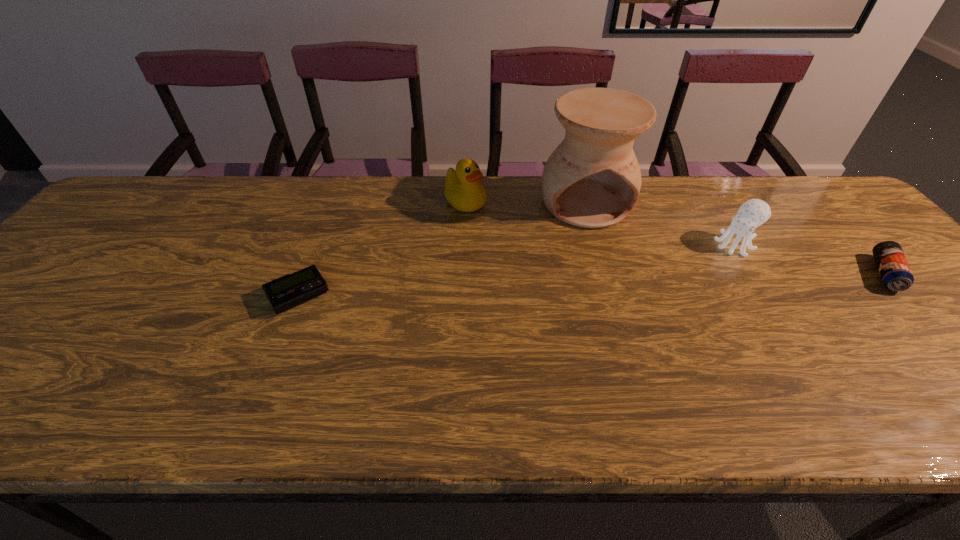
At what (x,y) coordinates should I click in order to perform the action: click on the leftmost object. Please return your answer as a coordinate pair (x, y). The width and height of the screenshot is (960, 540). Looking at the image, I should click on (288, 291).

Find the location of a particular element. The image size is (960, 540). beeper is located at coordinates (288, 291).

At what (x,y) coordinates should I click in order to perform the action: click on the rightmost object. Please return your answer as a coordinate pair (x, y). The height and width of the screenshot is (540, 960). Looking at the image, I should click on (896, 275).

The image size is (960, 540). Find the location of `the fourth tallest object`. the fourth tallest object is located at coordinates (896, 275).

Find the location of a particular element. the third tallest object is located at coordinates (753, 213).

The width and height of the screenshot is (960, 540). I want to click on the fourth object from left to right, so click(x=753, y=213).

Identify the location of duck. (x=462, y=190).

Where is `the fourth object from right to left`? The height and width of the screenshot is (540, 960). the fourth object from right to left is located at coordinates (462, 190).

Locate an element on the screen. the tallest object is located at coordinates (592, 179).

This screenshot has width=960, height=540. Identify the location of the third object from right to left. (592, 179).